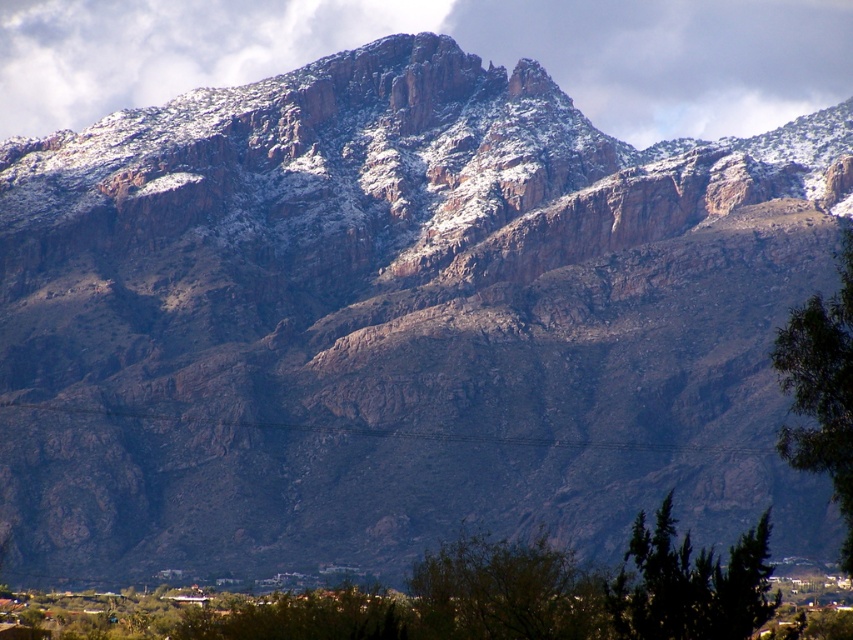
Question: Considering the real-world distances, which object is closest to the green leafy tree at lower center?

Choices:
 (A) green leafy tree at right
 (B) dark green coniferous tree at lower right

Answer: (B)

Question: Is dark green coniferous tree at lower right bigger than green leafy tree at right?

Choices:
 (A) no
 (B) yes

Answer: (A)

Question: Does green leafy tree at lower center have a smaller size compared to green leafy tree at right?

Choices:
 (A) yes
 (B) no

Answer: (A)

Question: Estimate the real-world distances between objects in this image. Which object is farther from the green leafy tree at lower center?

Choices:
 (A) dark green coniferous tree at lower right
 (B) green leafy tree at right

Answer: (B)

Question: Can you confirm if green leafy tree at lower center is smaller than dark green coniferous tree at lower right?

Choices:
 (A) no
 (B) yes

Answer: (B)

Question: Which point is closer to the camera?

Choices:
 (A) (689, 576)
 (B) (843, 273)

Answer: (A)